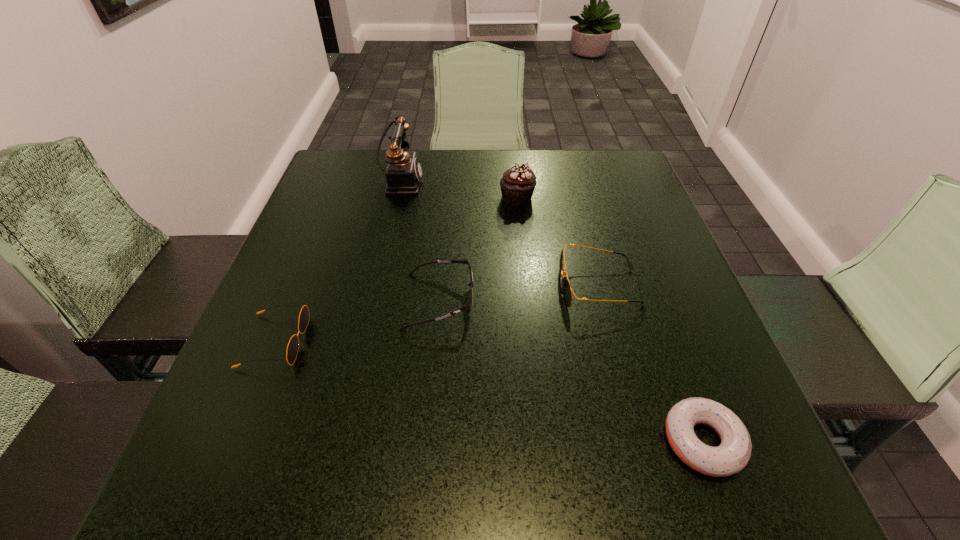
The width and height of the screenshot is (960, 540). In order to click on the tallest object in this screenshot , I will do `click(404, 173)`.

Find the location of a particular element. The image size is (960, 540). the second tallest object is located at coordinates (517, 185).

Locate an element on the screen. This screenshot has width=960, height=540. cupcake is located at coordinates (517, 185).

Find the location of a particular element. the second sunglasses from right to left is located at coordinates (468, 305).

You are a GUI agent. You are given a task and a screenshot of the screen. Output one action in this format:
    pyautogui.click(x=<x>, y=<y>)
    Task: Click on the rightmost sunglasses
    
    Given the screenshot: What is the action you would take?
    pyautogui.click(x=567, y=291)

Where is `the leftmost object`? The height and width of the screenshot is (540, 960). the leftmost object is located at coordinates (292, 349).

This screenshot has height=540, width=960. Identify the location of the shortest sunglasses. (292, 349).

The width and height of the screenshot is (960, 540). Identify the location of doughnut. (732, 455).

Identify the location of vacant region located 0.300m on the front of the tallest object at the rotary dial. The width and height of the screenshot is (960, 540). (537, 181).

In order to click on vacant space situated 0.070m on the front of the third object from right to left in this screenshot , I will do tap(519, 226).